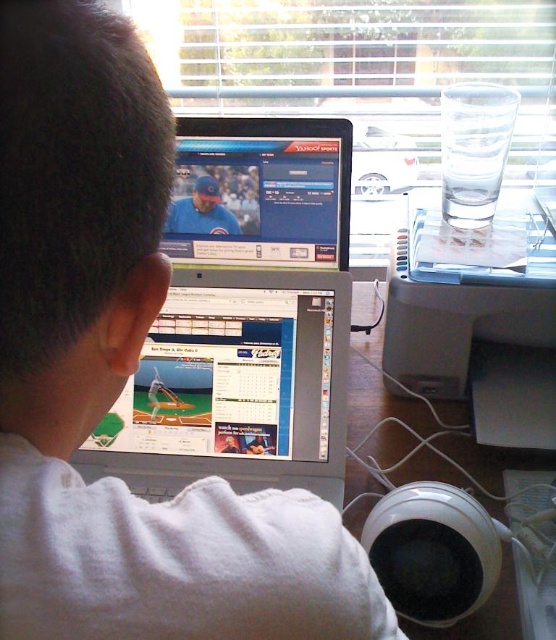
Is transparent plastic printer at upper right below matte black monitor at upper center?

Yes, transparent plastic printer at upper right is below matte black monitor at upper center.

Between point (533, 266) and point (255, 182), which one is positioned behind?

Positioned behind is point (533, 266).

Which is behind, point (492, 419) or point (216, 236)?

The point (492, 419) is more distant.

I want to click on transparent plastic printer at upper right, so click(475, 316).

Is silver metallic laptop at center to the right of matte black monitor at upper center from the viewer's perspective?

In fact, silver metallic laptop at center is to the left of matte black monitor at upper center.

Is point (198, 376) farther from camera compared to point (214, 260)?

No.

Is point (279, 211) behind point (217, 129)?

Yes.

Find the location of `silver metallic laptop at center`. silver metallic laptop at center is located at coordinates (245, 316).

Who is higher up, silver metallic laptop at center or transparent plastic printer at upper right?

transparent plastic printer at upper right is above.

Does silver metallic laptop at center have a greater height compared to transparent plastic printer at upper right?

Yes, silver metallic laptop at center is taller than transparent plastic printer at upper right.

Who is more forward, (350, 136) or (473, 300)?

Point (350, 136) is in front.

Locate an element on the screen. silver metallic laptop at center is located at coordinates (245, 316).